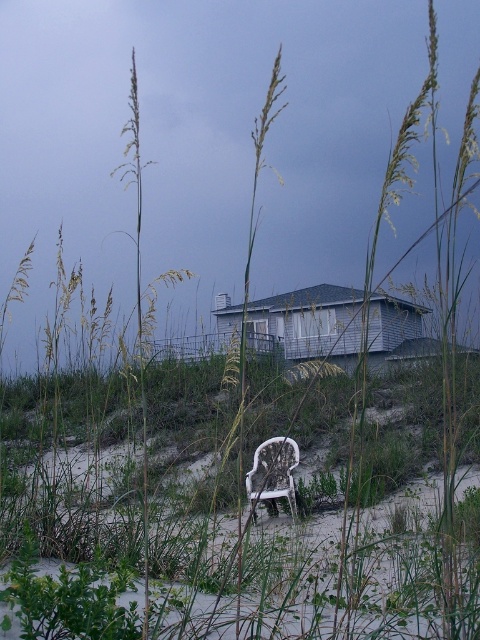
You are standing on the sandy area and want to move towards the small house. There is green grass at center and a white plastic chair at lower center in your path. Which object should you avoid stepping on to stay on the sandy area?

You should avoid stepping on the white plastic chair at lower center because the green grass at center is to the right of it, meaning the chair is closer to the sandy area. Stepping around the chair will keep you on the sand while moving toward the house.